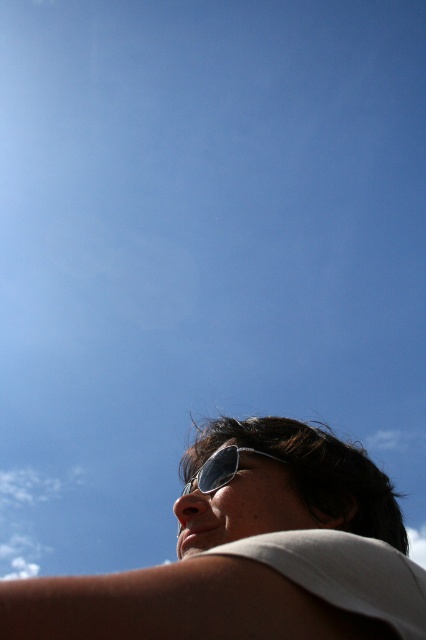
Is point (405, 540) in front of point (9, 540)?

Yes.

Is point (213, 556) closer to viewer compared to point (31, 552)?

Yes, point (213, 556) is in front of point (31, 552).

Locate an element on the screen. This screenshot has height=640, width=426. white matte sunglasses at upper center is located at coordinates (252, 552).

Is white fluffy cloud at upper left taller than metallic reflective sunglasses at lower center?

Indeed, white fluffy cloud at upper left has a greater height compared to metallic reflective sunglasses at lower center.

Who is positioned more to the right, white fluffy cloud at upper left or metallic reflective sunglasses at lower center?

Positioned to the right is metallic reflective sunglasses at lower center.

Measure the distance between white fluffy cloud at upper left and camera.

A distance of 270.96 feet exists between white fluffy cloud at upper left and camera.

Where is `white fluffy cloud at upper left`? white fluffy cloud at upper left is located at coordinates (25, 516).

Who is taller, white matte sunglasses at upper center or metallic reflective sunglasses at lower center?

→ Standing taller between the two is white matte sunglasses at upper center.

Locate an element on the screen. The image size is (426, 640). white matte sunglasses at upper center is located at coordinates click(x=252, y=552).

Which is behind, point (195, 573) or point (201, 481)?

Positioned behind is point (201, 481).

At what (x,y) coordinates should I click in order to perform the action: click on white matte sunglasses at upper center. Please return your answer as a coordinate pair (x, y). Looking at the image, I should click on (252, 552).